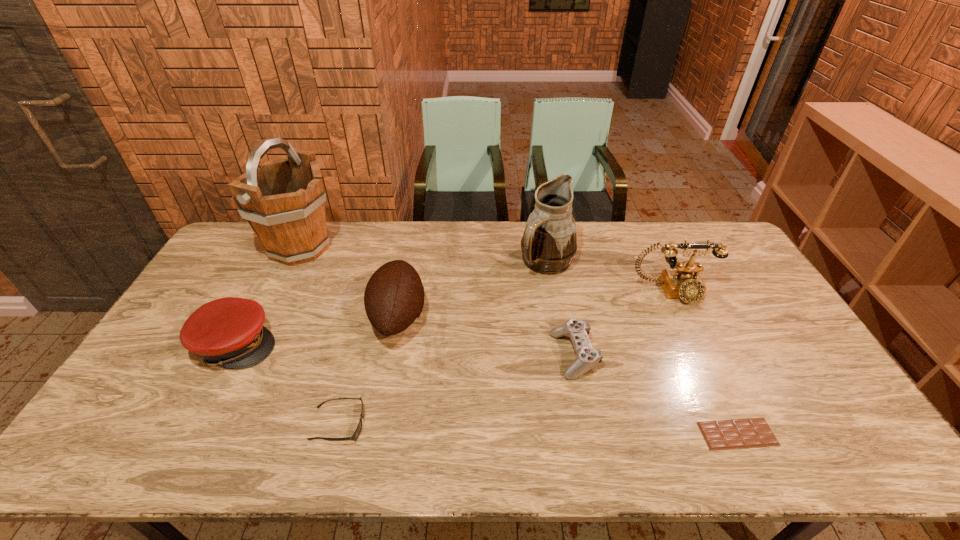
Identify the location of object that is the sixth closest to the sixth tallest object. (283, 200).

You are a GUI agent. You are given a task and a screenshot of the screen. Output one action in this format:
    pyautogui.click(x=<x>, y=<y>)
    Task: Click on the object that stands as the fourth closest to the football
    The width and height of the screenshot is (960, 540).
    Given the screenshot: What is the action you would take?
    tap(549, 243)

The height and width of the screenshot is (540, 960). Find the location of `blank area in the image that satisfies the following two spatial constraints: 1. on the front-facing side of the seventh tallest object; 2. on the back side of the shortest object`. blank area in the image that satisfies the following two spatial constraints: 1. on the front-facing side of the seventh tallest object; 2. on the back side of the shortest object is located at coordinates (336, 434).

This screenshot has width=960, height=540. Find the location of `vacant space that satisfies the following two spatial constraints: 1. on the laces of the sixth tallest object; 2. on the right side of the football`. vacant space that satisfies the following two spatial constraints: 1. on the laces of the sixth tallest object; 2. on the right side of the football is located at coordinates (391, 355).

Image resolution: width=960 pixels, height=540 pixels. In order to click on vacant space that satisfies the following two spatial constraints: 1. on the front of the cap with an emblem; 2. on the right side of the shortest object in this screenshot , I will do `click(190, 434)`.

In order to click on free space that satisfies the following two spatial constraints: 1. on the back side of the chocolate bar; 2. on the front-facing side of the second shortest object in this screenshot , I will do `click(733, 424)`.

This screenshot has height=540, width=960. I want to click on vacant region that satisfies the following two spatial constraints: 1. on the front of the third shortest object with an emblem; 2. on the left side of the cap, so click(x=231, y=355).